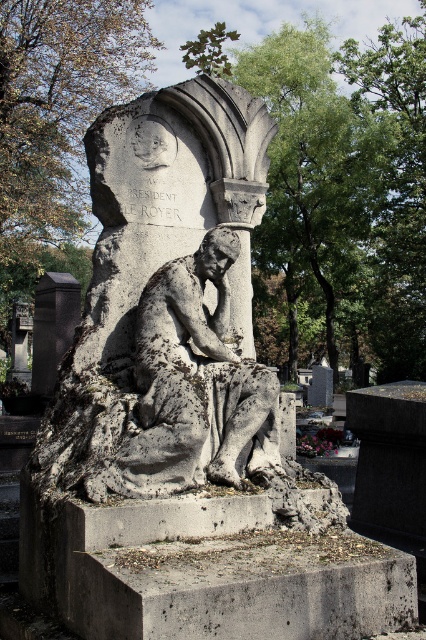
Question: Considering the relative positions of gray stone statue at center and black stone pillar at lower left in the image provided, where is gray stone statue at center located with respect to black stone pillar at lower left?

Choices:
 (A) above
 (B) below

Answer: (A)

Question: Does gray stone statue at center have a lesser width compared to black stone pillar at lower left?

Choices:
 (A) yes
 (B) no

Answer: (A)

Question: Can you confirm if gray stone statue at center is smaller than black stone pillar at lower left?

Choices:
 (A) yes
 (B) no

Answer: (A)